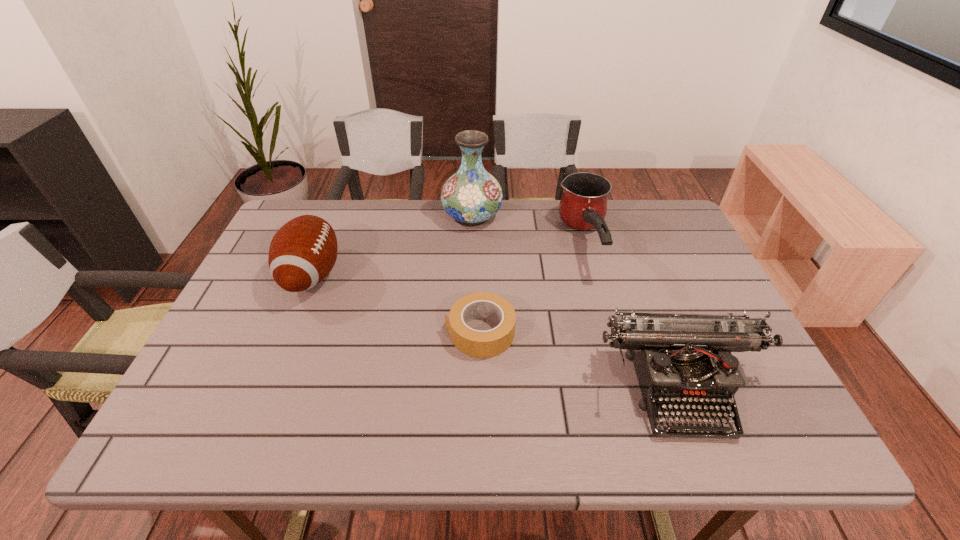
The width and height of the screenshot is (960, 540). Identify the location of object that can be found as the closest to the shortest object. (682, 361).

This screenshot has width=960, height=540. Identify the location of vacant space that satisfies the following two spatial constraints: 1. on the handle side of the saucepan; 2. on the laces of the football. (594, 275).

Locate an element on the screen. vacant position in the image that satisfies the following two spatial constraints: 1. on the handle side of the saucepan; 2. on the laces of the leftmost object is located at coordinates (594, 275).